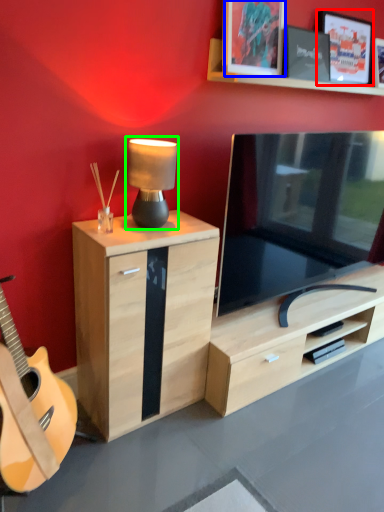
Question: Considering the real-world distances, which object is closest to picture frame (highlighted by a red box)? picture frame (highlighted by a blue box) or table lamp (highlighted by a green box).

Choices:
 (A) picture frame
 (B) table lamp

Answer: (A)